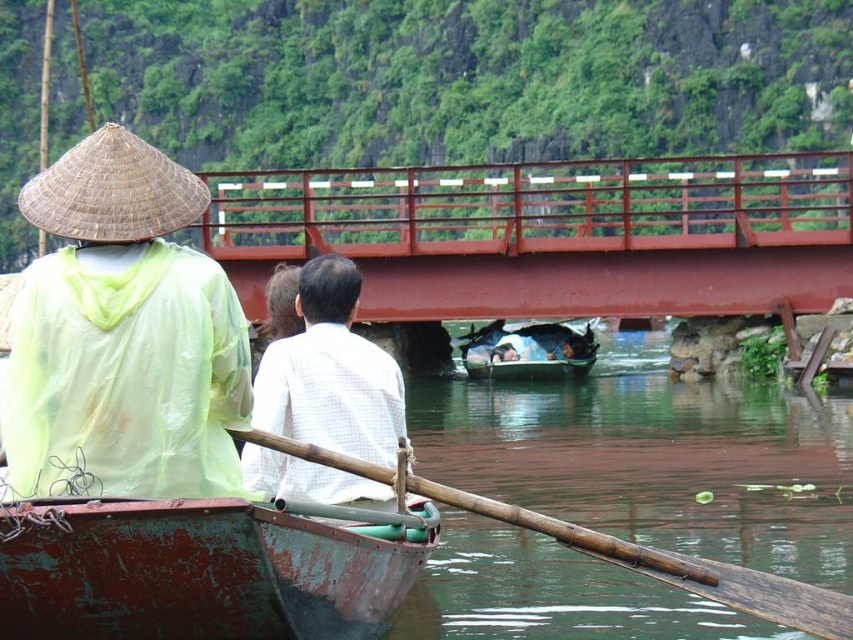
Which is above, green translucent raincoat at upper left or braided straw hat at upper left?

braided straw hat at upper left is higher up.

Which of these two, green translucent raincoat at upper left or braided straw hat at upper left, stands shorter?

braided straw hat at upper left is shorter.

This screenshot has height=640, width=853. What do you see at coordinates (122, 333) in the screenshot?
I see `green translucent raincoat at upper left` at bounding box center [122, 333].

I want to click on green translucent raincoat at upper left, so [122, 333].

Between red metal bridge at center and green wooden canoe at center, which one has less height?

green wooden canoe at center is shorter.

Between red metal bridge at center and green wooden canoe at center, which one appears on the left side from the viewer's perspective?

green wooden canoe at center

Is point (471, 264) closer to viewer compared to point (570, 364)?

Yes, it is.

The height and width of the screenshot is (640, 853). I want to click on red metal bridge at center, so click(x=553, y=234).

Is point (581, 529) in front of point (74, 195)?

Yes.

Who is more forward, (x=779, y=577) or (x=42, y=195)?

Point (x=42, y=195)

This screenshot has width=853, height=640. I want to click on brown bamboo paddle at lower center, so click(x=613, y=548).